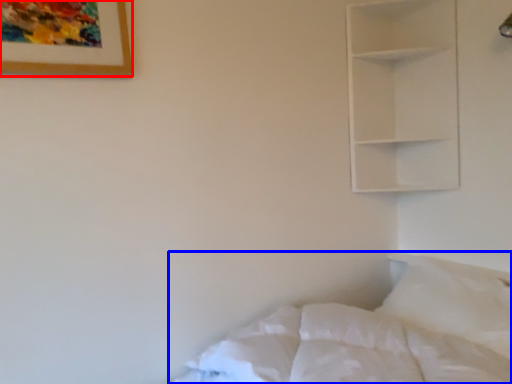
Question: Which point is further to the camera, picture frame (highlighted by a red box) or bed (highlighted by a blue box)?

Choices:
 (A) picture frame
 (B) bed

Answer: (A)